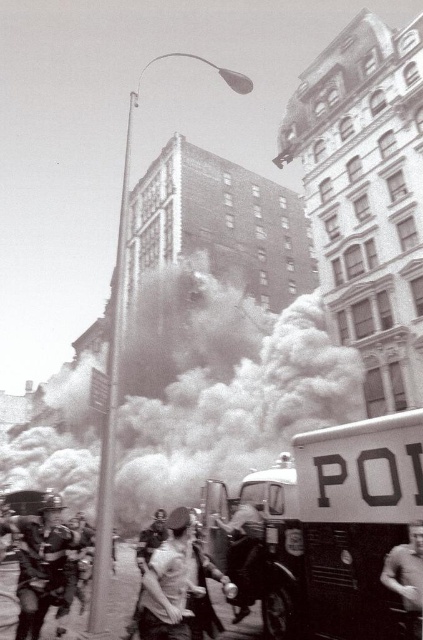
Between smooth leather jacket at center and smooth skin person at center, which one is positioned lower?

smooth leather jacket at center is below.

At what (x,y) coordinates should I click in order to perform the action: click on smooth leather jacket at center. Please return your answer as a coordinate pair (x, y). Looking at the image, I should click on (244, 552).

Where is `smooth leather jacket at center`? The width and height of the screenshot is (423, 640). smooth leather jacket at center is located at coordinates (244, 552).

Locate an element on the screen. smooth leather jacket at center is located at coordinates (244, 552).

Does metallic helmet at center appear on the right side of smooth skin person at center?

In fact, metallic helmet at center is to the left of smooth skin person at center.

Can you confirm if metallic helmet at center is shorter than smooth skin person at center?

Incorrect, metallic helmet at center's height does not fall short of smooth skin person at center's.

Who is more distant from viewer, (x=60, y=508) or (x=411, y=560)?

Positioned behind is point (x=60, y=508).

Find the location of a particular element. This screenshot has width=423, height=640. metallic helmet at center is located at coordinates (41, 564).

Does point (62, 449) come closer to viewer compared to point (170, 524)?

No.

Can you confirm if foggy white smoke at center is bigger than skinny white shirt at center?

Yes, foggy white smoke at center is bigger than skinny white shirt at center.

Locate an element on the screen. foggy white smoke at center is located at coordinates (231, 401).